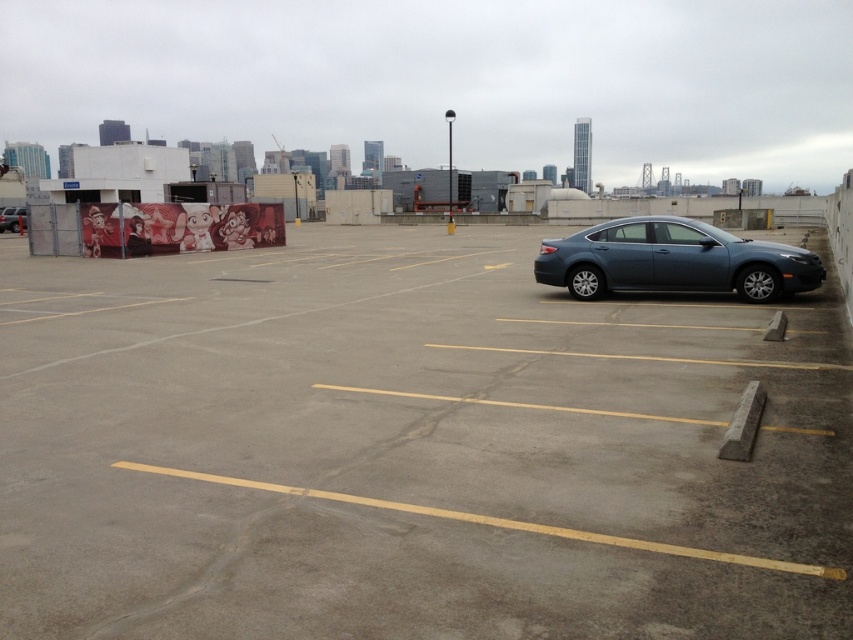
Question: Which is farther from the gray concrete parking lot at center?

Choices:
 (A) matte black sedan at center
 (B) satin gray sedan at right

Answer: (A)

Question: Which object is closer to the camera taking this photo?

Choices:
 (A) matte black sedan at center
 (B) gray concrete parking lot at center
 (C) satin gray sedan at right

Answer: (B)

Question: Is gray concrete parking lot at center wider than satin gray sedan at right?

Choices:
 (A) yes
 (B) no

Answer: (A)

Question: Is gray concrete parking lot at center bigger than matte black sedan at center?

Choices:
 (A) yes
 (B) no

Answer: (A)

Question: Can you confirm if satin gray sedan at right is positioned below matte black sedan at center?

Choices:
 (A) yes
 (B) no

Answer: (A)

Question: Which object appears closest to the camera in this image?

Choices:
 (A) satin gray sedan at right
 (B) gray concrete parking lot at center
 (C) matte black sedan at center

Answer: (B)